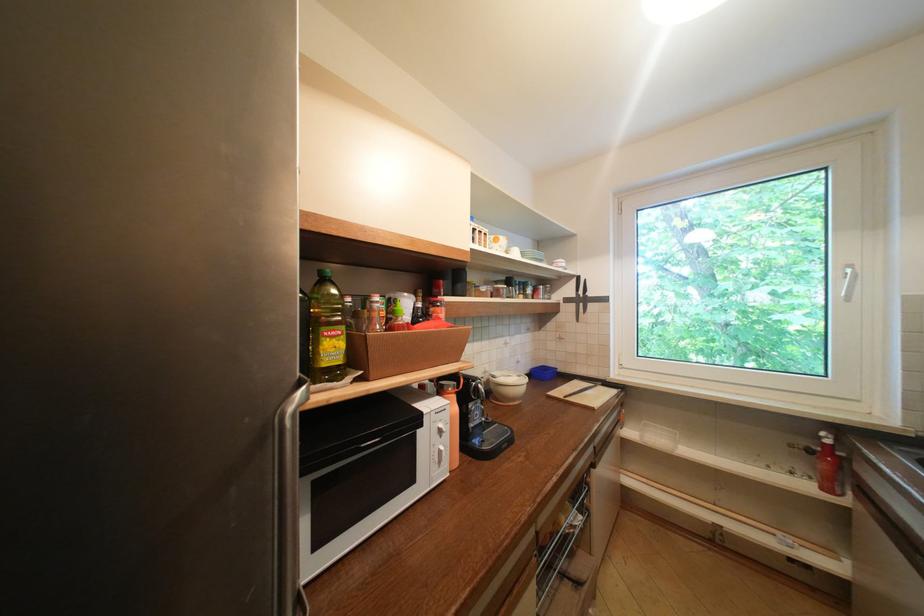
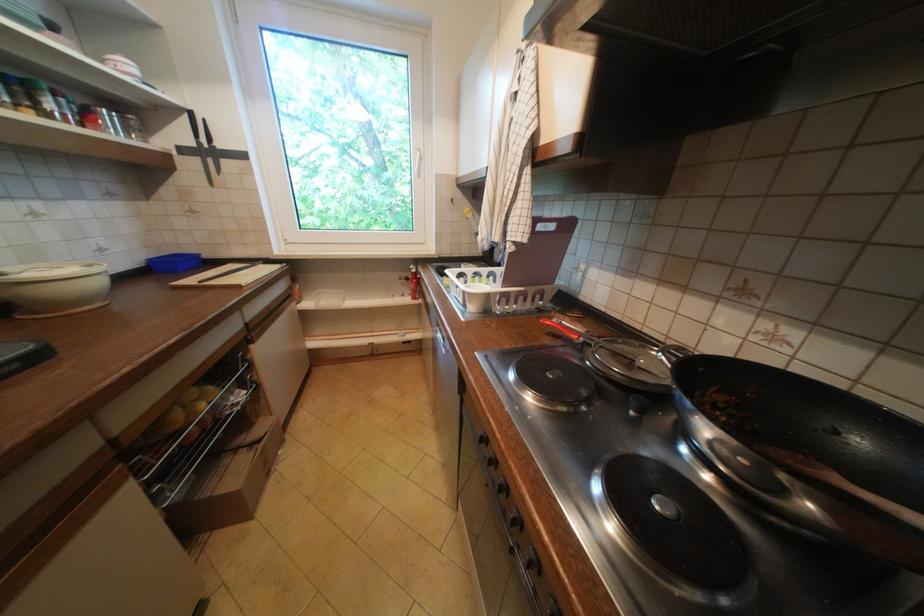
Where in the second image is the point corresponding to point (582, 282) from the first image?

(195, 119)